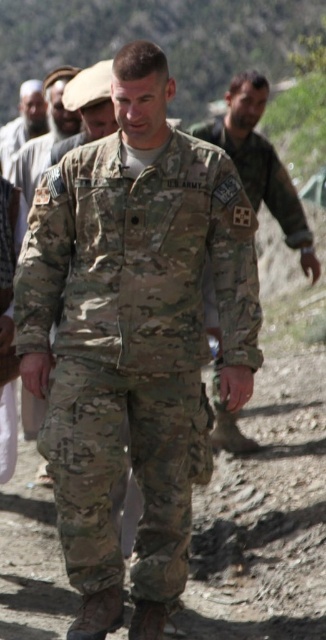
What are the coordinates of the camouflage fabric uniform at center?

The camouflage fabric uniform at center is located at point (133, 340).